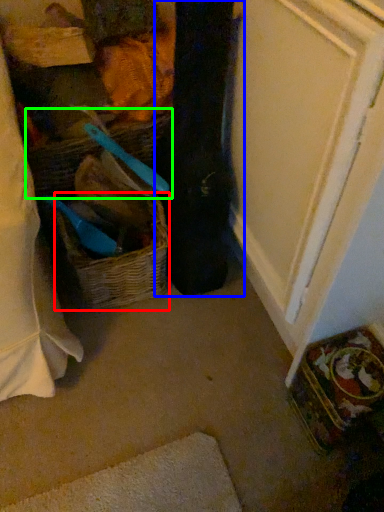
Question: Which object is the closest to the picnic basket (highlighted by a red box)? Choose among these: clothing (highlighted by a blue box) or basket (highlighted by a green box).

Choices:
 (A) clothing
 (B) basket

Answer: (A)